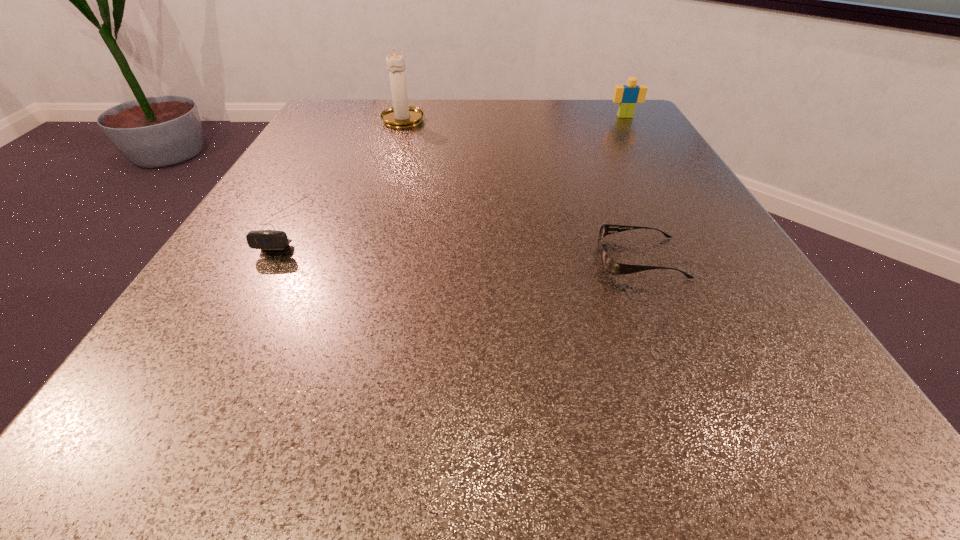
Where is `vacant area that lies between the shortest object and the tallest object`? vacant area that lies between the shortest object and the tallest object is located at coordinates (521, 188).

Locate an element on the screen. vacant space that is in between the third object from right to left and the rightmost object is located at coordinates (515, 117).

This screenshot has width=960, height=540. I want to click on free spot between the rightmost object and the candle holder, so click(x=515, y=117).

You are a GUI agent. You are given a task and a screenshot of the screen. Output one action in this format:
    pyautogui.click(x=<x>, y=<y>)
    Task: Click on the free space between the second tallest object and the tallest object
    This screenshot has width=960, height=540.
    Given the screenshot: What is the action you would take?
    pyautogui.click(x=515, y=117)

Locate an element on the screen. This screenshot has width=960, height=540. free space between the candle holder and the shortest object is located at coordinates (521, 188).

You are a GUI agent. You are given a task and a screenshot of the screen. Output one action in this format:
    pyautogui.click(x=<x>, y=<y>)
    Task: Click on the free space between the third shortest object and the second object from right to left
    This screenshot has width=960, height=540.
    Given the screenshot: What is the action you would take?
    pyautogui.click(x=633, y=187)

This screenshot has width=960, height=540. What are the coordinates of `unoccupied area between the second tallest object and the leftmost object` in the screenshot? It's located at (455, 170).

In order to click on vacant area that lies between the webcam and the shortest object in this screenshot , I will do `click(463, 241)`.

You are a GUI agent. You are given a task and a screenshot of the screen. Output one action in this format:
    pyautogui.click(x=<x>, y=<y>)
    Task: Click on the vacant area that lies between the shortest object and the second shortest object
    
    Given the screenshot: What is the action you would take?
    pyautogui.click(x=463, y=241)

The width and height of the screenshot is (960, 540). Find the location of `vacant area that lies between the shortest object and the second shortest object`. vacant area that lies between the shortest object and the second shortest object is located at coordinates (463, 241).